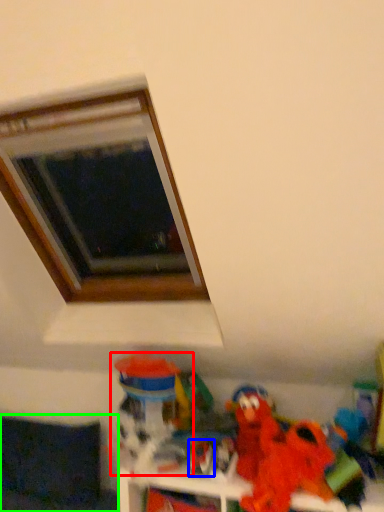
Question: Which object is positioned farthest from toy (highlighted by a red box)? Select from toy (highlighted by a blue box) and couch (highlighted by a green box).

Choices:
 (A) toy
 (B) couch

Answer: (B)